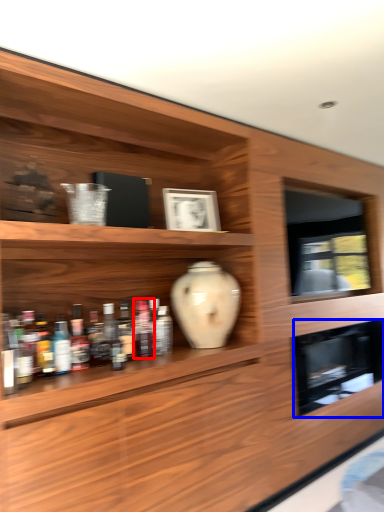
Question: Which object is further to the camera taking this photo, bottle (highlighted by a red box) or cabinet (highlighted by a blue box)?

Choices:
 (A) bottle
 (B) cabinet

Answer: (B)